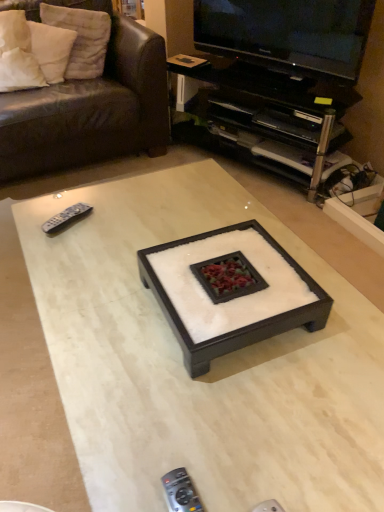
I want to click on vacant area to the left of white felt square tray at center, the 2th coffee table positioned from the bottom, so click(101, 305).